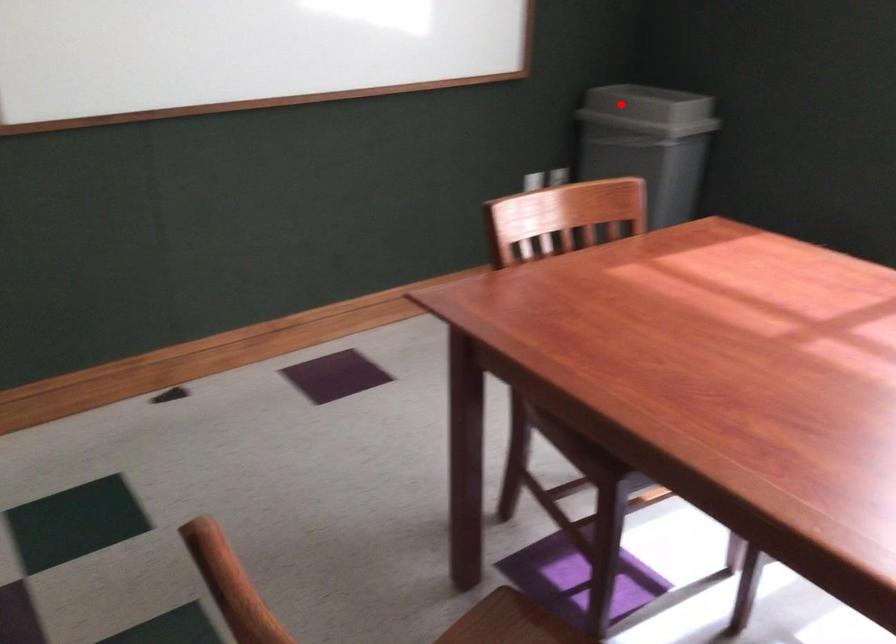
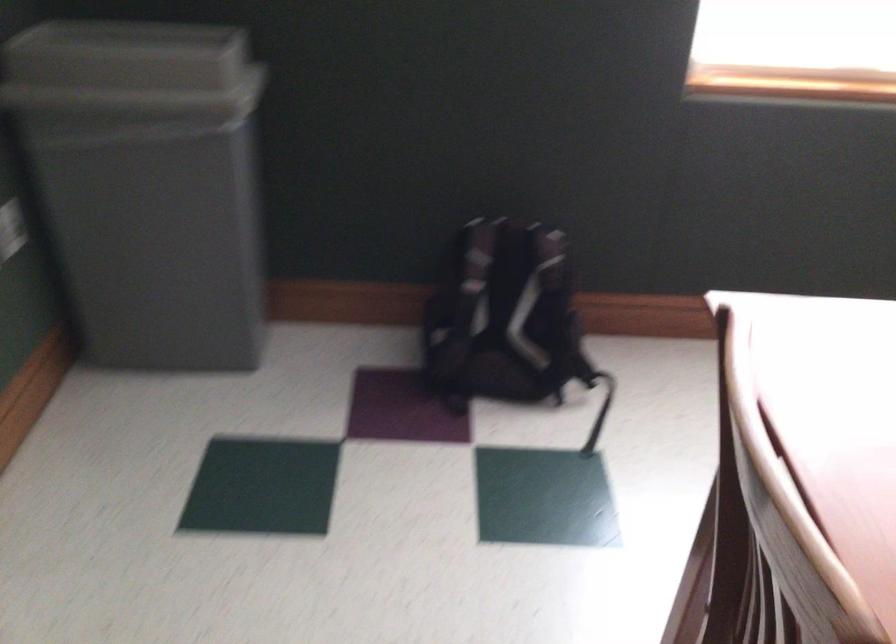
Where in the second image is the point corresponding to the highlighted location from the first image?

(131, 71)